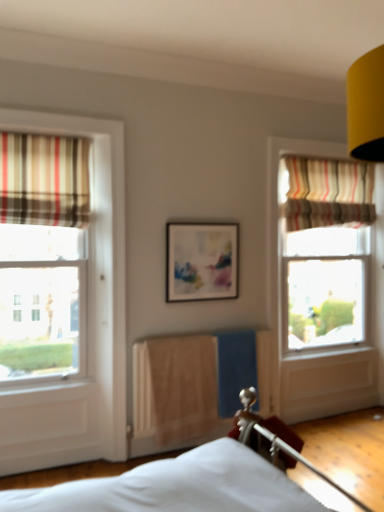
Where is `free point above striped fabric curtain at left, positioned as the first curtain in left-to-right order (from a real-world perspective)`? free point above striped fabric curtain at left, positioned as the first curtain in left-to-right order (from a real-world perspective) is located at coordinates (48, 133).